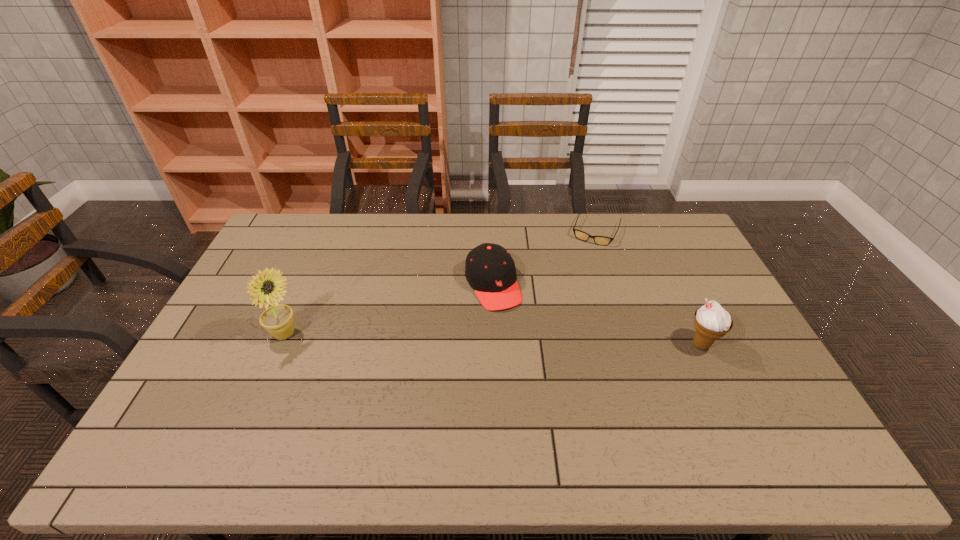
Image resolution: width=960 pixels, height=540 pixels. Identify the location of free space that is in between the sunglasses and the third tallest object. (544, 258).

The image size is (960, 540). Find the location of `free space between the sunglasses and the rightmost object`. free space between the sunglasses and the rightmost object is located at coordinates (649, 287).

Locate which object ranks third in proximity to the tallest object. Please provide its 2D coordinates. Your answer should be formatted as a tuple, i.e. [(x, y)], where the tuple contains the x and y coordinates of a point satisfying the conditions above.

[(711, 321)]

Find the location of a particular element. object that is the third closest one to the farthest object is located at coordinates (267, 288).

This screenshot has height=540, width=960. I want to click on free space that satisfies the following two spatial constraints: 1. on the front side of the second tallest object; 2. on the right side of the third object from left to right, so click(x=634, y=345).